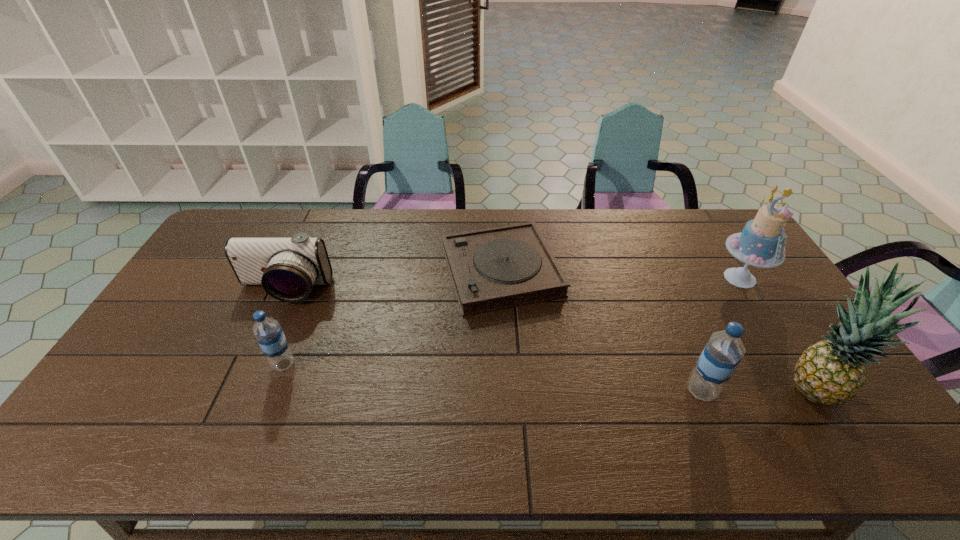
What are the coordinates of `the shorter water bottle` in the screenshot? It's located at (268, 332).

Where is `the left water bottle`? This screenshot has height=540, width=960. the left water bottle is located at coordinates (268, 332).

Identify the location of the nearer water bottle. (723, 352).

Locate an element on the screen. the third object from right to left is located at coordinates point(723,352).

Where is `the second tallest object`? The image size is (960, 540). the second tallest object is located at coordinates (761, 243).

Identify the location of camcorder. (287, 268).

The height and width of the screenshot is (540, 960). Find the location of `phonograph record`. phonograph record is located at coordinates [497, 268].

I want to click on the fourth object from right to left, so click(497, 268).

I want to click on pineapple, so click(x=832, y=372).

I want to click on free space located on the label of the farther water bottle, so click(x=324, y=364).